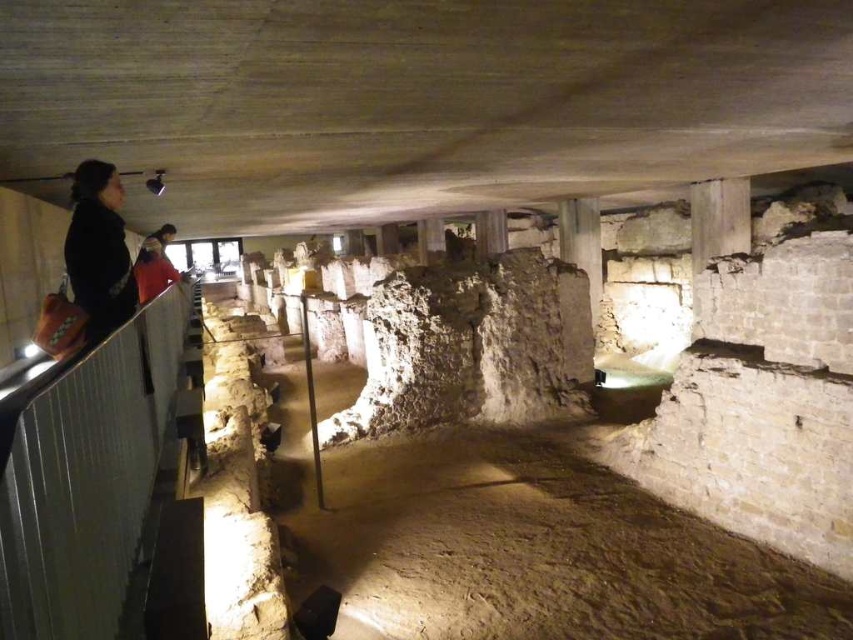
You are standing at the entrance of the archaeological site and want to reach the point marked as point [136,580]. However, there is an obstacle at point [103,220] blocking your path. Can you still reach your destination without going around the obstacle?

Point [136,580] is in front of point [103,220], so the obstacle at point [103,220] is behind the destination. Therefore, you can reach point [136,580] without needing to go around the obstacle.